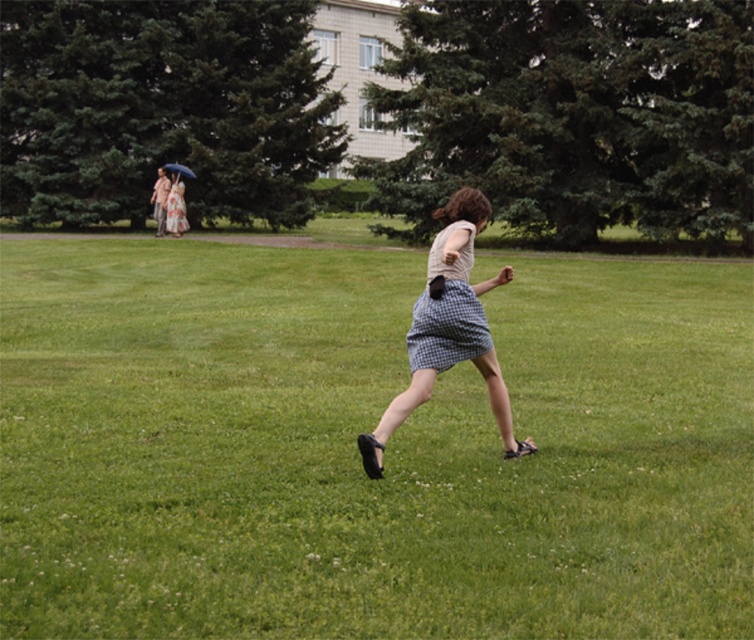
Between checkered fabric skirt at center and matte white dress at upper left, which one appears on the right side from the viewer's perspective?

Positioned to the right is checkered fabric skirt at center.

You are a GUI agent. You are given a task and a screenshot of the screen. Output one action in this format:
    pyautogui.click(x=<x>, y=<y>)
    Task: Click on the checkered fabric skirt at center
    
    Given the screenshot: What is the action you would take?
    pyautogui.click(x=449, y=328)

Which is behind, point (503, 396) or point (169, 228)?

Point (169, 228)

Locate an element on the screen. checkered fabric skirt at center is located at coordinates (449, 328).

Is green grass at center wider than matte white dress at upper left?

Yes, green grass at center is wider than matte white dress at upper left.

Can you confirm if green grass at center is bigger than matte white dress at upper left?

Correct, green grass at center is larger in size than matte white dress at upper left.

Does point (185, 483) come in front of point (169, 189)?

That is True.

Identify the location of green grass at center. The image size is (754, 640). (357, 454).

Based on the photo, can you confirm if checkered fabric dress at center is positioned above matte white dress at upper left?

Actually, checkered fabric dress at center is below matte white dress at upper left.

Which is behind, point (464, 339) or point (170, 220)?

Positioned behind is point (170, 220).

Which is in front, point (489, 339) or point (170, 176)?

Positioned in front is point (489, 339).

Find the location of a particular element. The width and height of the screenshot is (754, 640). checkered fabric dress at center is located at coordinates (446, 310).